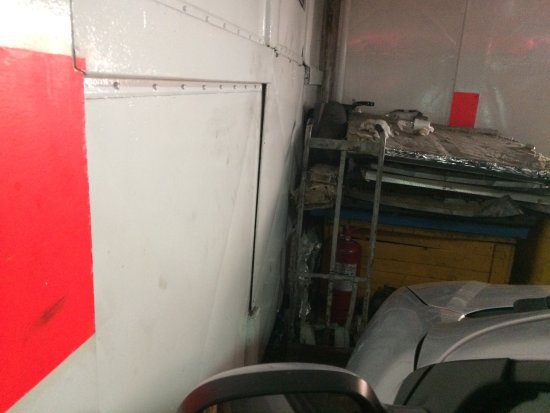
Image resolution: width=550 pixels, height=413 pixels. Find the location of `dirty surface`. dirty surface is located at coordinates (522, 151).